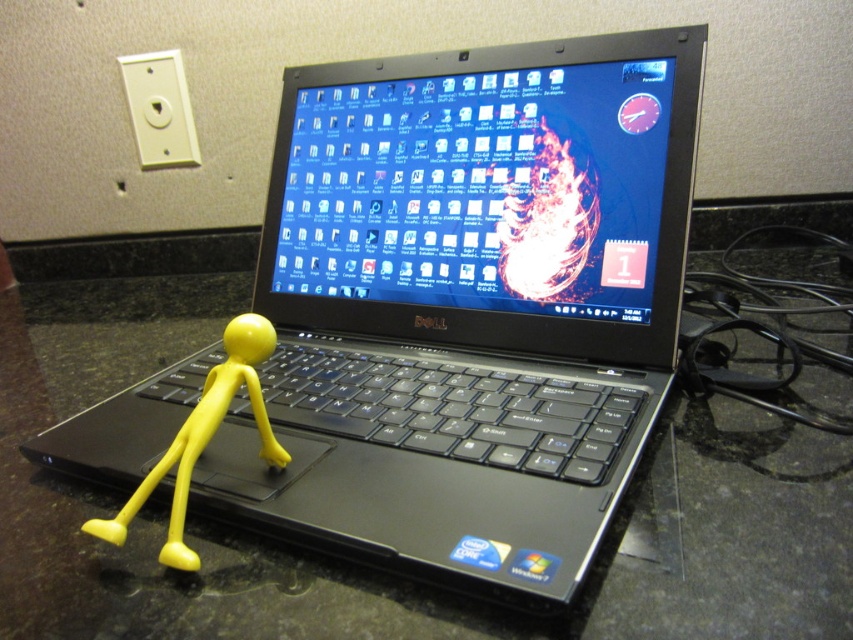
Question: Estimate the real-world distances between objects in this image. Which object is farther from the shiny plastic laptop at center?

Choices:
 (A) black matte keyboard at center
 (B) yellow matte stick figure at center

Answer: (B)

Question: Among these points, which one is nearest to the camera?

Choices:
 (A) (102, 518)
 (B) (389, 420)

Answer: (A)

Question: Does shiny plastic laptop at center have a larger size compared to yellow matte stick figure at center?

Choices:
 (A) no
 (B) yes

Answer: (B)

Question: Does black matte keyboard at center appear on the right side of yellow matte stick figure at center?

Choices:
 (A) yes
 (B) no

Answer: (A)

Question: Among these objects, which one is nearest to the camera?

Choices:
 (A) black matte keyboard at center
 (B) shiny plastic laptop at center

Answer: (A)

Question: Is shiny plastic laptop at center above yellow matte stick figure at center?

Choices:
 (A) no
 (B) yes

Answer: (B)